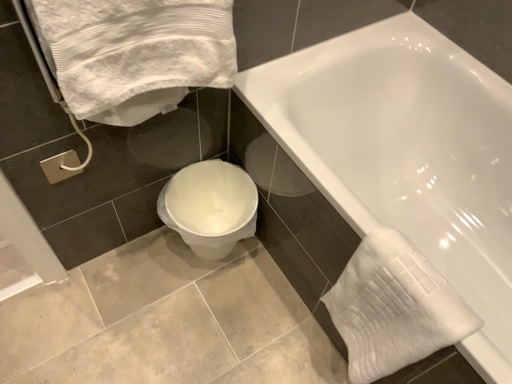
Question: Considering the relative sizes of white plastic toilet at lower center and white textured towel at lower right, marked as the second bath towel in a left-to-right arrangement, in the image provided, is white plastic toilet at lower center wider than white textured towel at lower right, marked as the second bath towel in a left-to-right arrangement,?

Choices:
 (A) no
 (B) yes

Answer: (B)

Question: From the image's perspective, is white plastic toilet at lower center located beneath white textured towel at lower right, positioned as the 1th bath towel in bottom-to-top order?

Choices:
 (A) yes
 (B) no

Answer: (B)

Question: Can you confirm if white plastic toilet at lower center is shorter than white textured towel at lower right, positioned as the 1th bath towel in bottom-to-top order?

Choices:
 (A) no
 (B) yes

Answer: (B)

Question: Could white textured towel at lower right, positioned as the 1th bath towel in bottom-to-top order, be considered to be inside white plastic toilet at lower center?

Choices:
 (A) no
 (B) yes

Answer: (A)

Question: Is white plastic toilet at lower center further to the viewer compared to white textured towel at lower right, which is the 2th bath towel in top-to-bottom order?

Choices:
 (A) yes
 (B) no

Answer: (A)

Question: Is white plastic toilet at lower center touching white textured towel at lower right, positioned as the 1th bath towel in bottom-to-top order?

Choices:
 (A) yes
 (B) no

Answer: (B)

Question: Does silver metallic towel bar at lower left have a smaller size compared to white textured towel at lower right, marked as the second bath towel in a left-to-right arrangement?

Choices:
 (A) no
 (B) yes

Answer: (B)

Question: Is silver metallic towel bar at lower left outside of white textured towel at lower right, which is the 2th bath towel in top-to-bottom order?

Choices:
 (A) yes
 (B) no

Answer: (A)

Question: Is silver metallic towel bar at lower left bigger than white textured towel at lower right, marked as the second bath towel in a left-to-right arrangement?

Choices:
 (A) yes
 (B) no

Answer: (B)

Question: Considering the relative sizes of silver metallic towel bar at lower left and white textured towel at lower right, marked as the second bath towel in a left-to-right arrangement, in the image provided, is silver metallic towel bar at lower left wider than white textured towel at lower right, marked as the second bath towel in a left-to-right arrangement,?

Choices:
 (A) yes
 (B) no

Answer: (B)

Question: Is silver metallic towel bar at lower left facing away from white textured towel at lower right, positioned as the 1th bath towel in bottom-to-top order?

Choices:
 (A) no
 (B) yes

Answer: (A)

Question: From the image's perspective, would you say silver metallic towel bar at lower left is shown under white textured towel at lower right, which is the 2th bath towel in top-to-bottom order?

Choices:
 (A) no
 (B) yes

Answer: (A)

Question: Is white glossy bathtub at center located outside white textured towel at lower right, which is the 2th bath towel in top-to-bottom order?

Choices:
 (A) no
 (B) yes

Answer: (B)